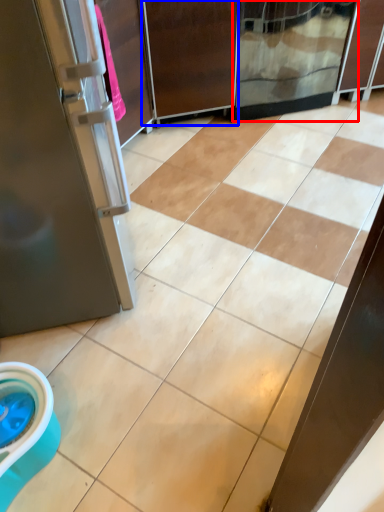
Question: Which point is closer to the camera, screen door (highlighted by a red box) or screen door (highlighted by a blue box)?

Choices:
 (A) screen door
 (B) screen door

Answer: (B)